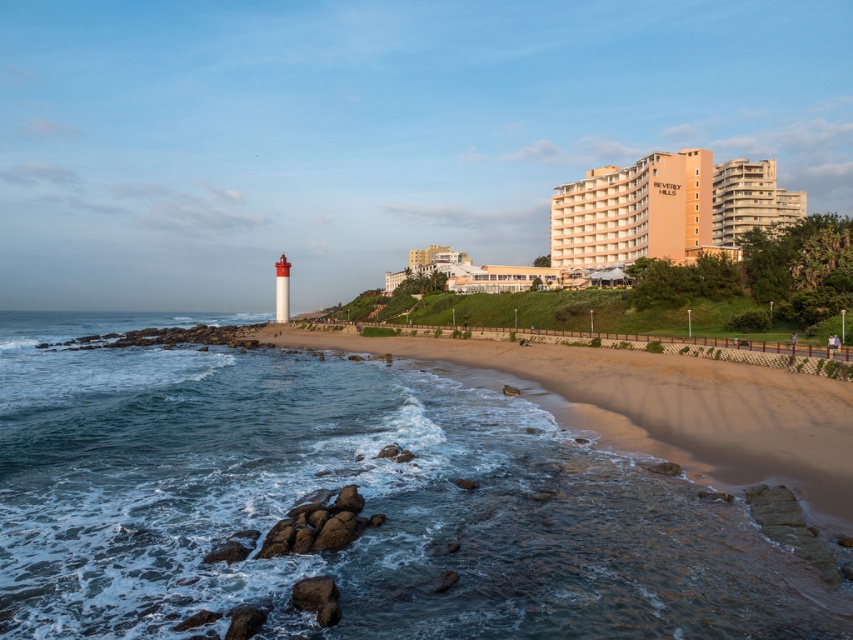
What do you see at coordinates (358, 492) in the screenshot? I see `clear water at beach left` at bounding box center [358, 492].

Does clear water at beach left appear on the right side of sandy beach at lower center?

In fact, clear water at beach left is to the left of sandy beach at lower center.

Measure the distance between point (674, 579) and camera.

They are 13.10 meters apart.

Find the location of `clear water at beach left`. clear water at beach left is located at coordinates (358, 492).

Between clear water at beach left and beige concrete building at upper right, which one has more height?

beige concrete building at upper right

Describe the element at coordinates (358, 492) in the screenshot. I see `clear water at beach left` at that location.

Which is behind, point (369, 385) or point (659, 224)?

Positioned behind is point (659, 224).

Locate an element on the screen. The width and height of the screenshot is (853, 640). clear water at beach left is located at coordinates (358, 492).

Which is more to the left, sandy beach at lower center or beige concrete building at upper right?

sandy beach at lower center

Between point (711, 388) and point (581, 209), which one is positioned in front?

Point (711, 388)

Where is `sandy beach at lower center`? This screenshot has height=640, width=853. sandy beach at lower center is located at coordinates (669, 406).